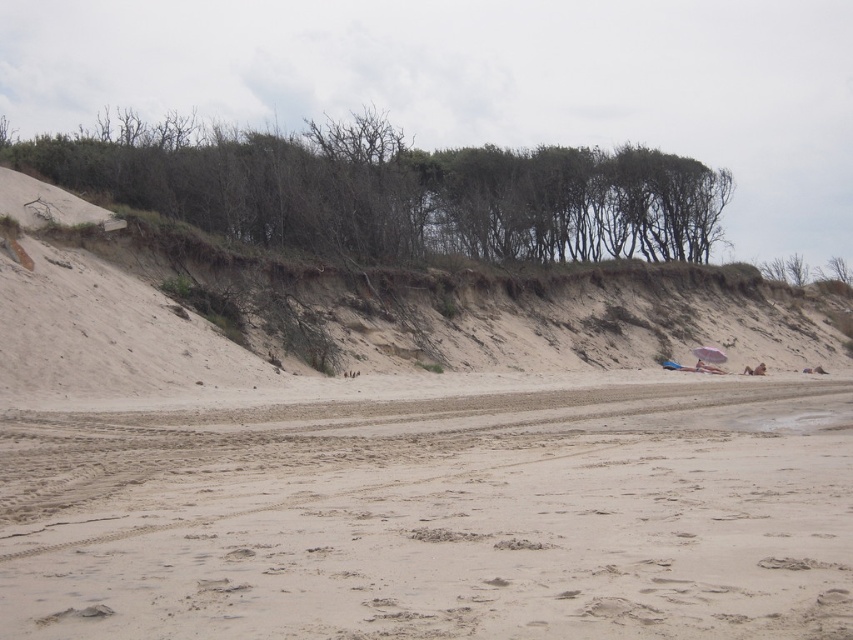
You are standing on the light beige sand at center and want to walk towards the green leafy trees at upper center. Which direction should you head?

You should head upwards because the green leafy trees at upper center are located above the light beige sand at center.

From the picture: You are a photographer trying to capture a landscape shot of the beach. You want to ensure that the light beige sand at center and the brown sandy hillside at upper center are both visible in your frame. Based on their heights, which object will appear closer to the horizon line?

The light beige sand at center has a lesser height compared to the brown sandy hillside at upper center. Since the light beige sand is lower, it will appear closer to the horizon line in the photograph.